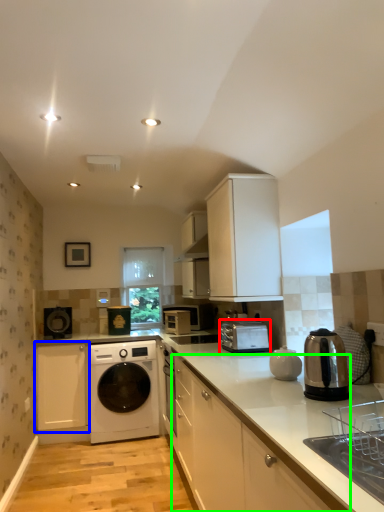
Question: Which object is the closest to the home appliance (highlighted by a red box)? Choose among these: cabinetry (highlighted by a blue box) or cabinetry (highlighted by a green box).

Choices:
 (A) cabinetry
 (B) cabinetry

Answer: (B)